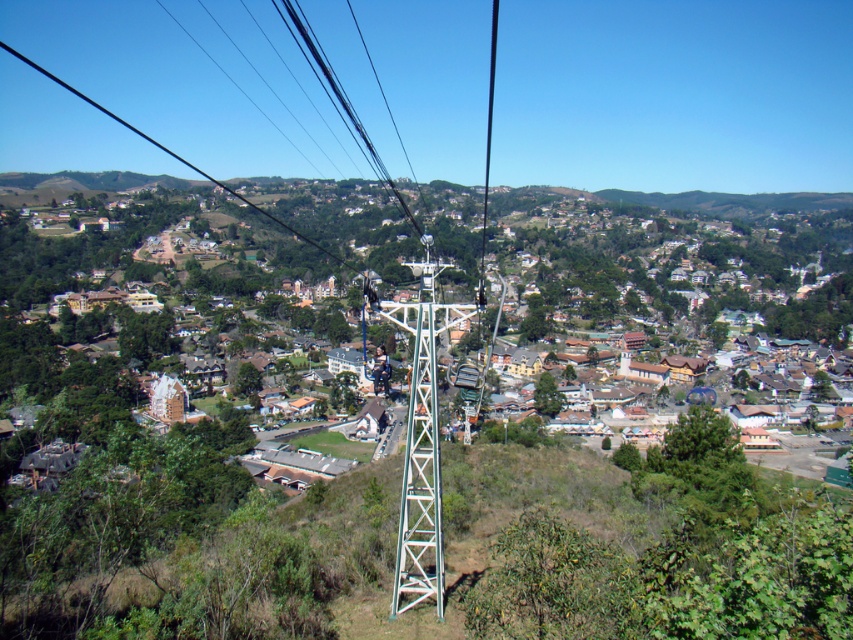
Question: Where is brown wooden houses at lower left located in relation to black cable at center in the image?

Choices:
 (A) above
 (B) below

Answer: (B)

Question: Which point is farther from the camera taking this photo?

Choices:
 (A) (413, 596)
 (B) (448, 225)
 (C) (491, 13)
 (D) (35, 65)

Answer: (D)

Question: Which point is closer to the camera?

Choices:
 (A) (0, 44)
 (B) (494, 32)

Answer: (B)

Question: Is green metallic tower at center further to camera compared to black wire at left?

Choices:
 (A) no
 (B) yes

Answer: (A)

Question: Based on their relative distances, which object is nearer to the green metallic tower at center?

Choices:
 (A) black cable at center
 (B) black wire at left
 (C) brown wooden houses at lower left

Answer: (A)

Question: Observing the image, what is the correct spatial positioning of brown wooden houses at lower left in reference to black cable at center?

Choices:
 (A) below
 (B) above

Answer: (A)